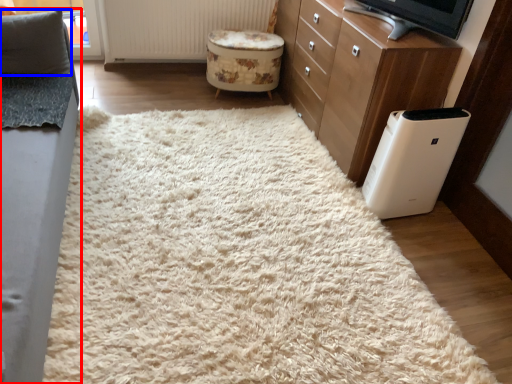
Question: Which object is further to the camera taking this photo, furniture (highlighted by a red box) or pillow (highlighted by a blue box)?

Choices:
 (A) furniture
 (B) pillow

Answer: (B)